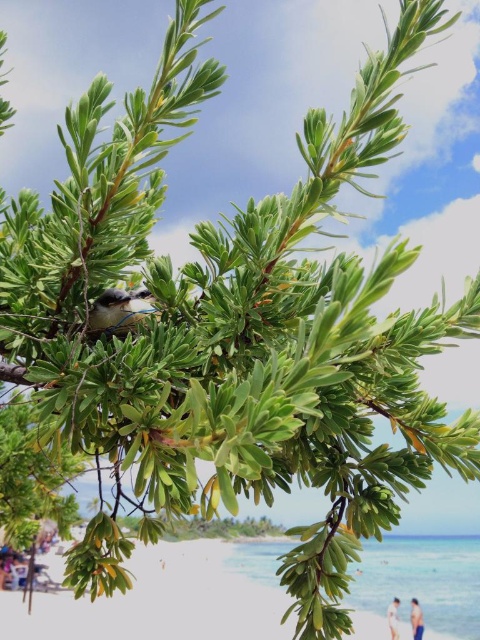
Question: Does white sand beach at lower left appear over soft brown feathers at center?

Choices:
 (A) no
 (B) yes

Answer: (A)

Question: Which of these objects is positioned closest to the white cotton shirt at lower right?

Choices:
 (A) white sand beach at lower left
 (B) soft brown feathers at center
 (C) light blue skin at lower right

Answer: (C)

Question: Which point is farther from the camera taking this photo?

Choices:
 (A) (99, 307)
 (B) (384, 554)
 (C) (417, 611)
 (D) (397, 636)

Answer: (D)

Question: Among these points, which one is nearest to the camera?

Choices:
 (A) (98, 310)
 (B) (200, 545)
 (C) (420, 614)
 (D) (398, 605)

Answer: (A)

Question: Can you confirm if white sand beach at lower left is positioned below white cotton shirt at lower right?

Choices:
 (A) yes
 (B) no

Answer: (B)

Question: Is white sand beach at lower left smaller than soft brown feathers at center?

Choices:
 (A) no
 (B) yes

Answer: (A)